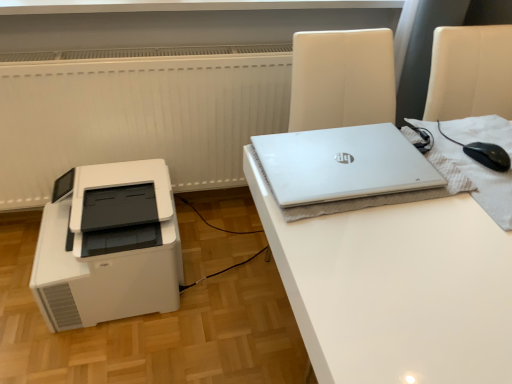
At what (x,y) coordinates should I click in order to perform the action: click on vacant space in front of black matte mouse at right. Please return your answer as a coordinate pair (x, y). Looking at the image, I should click on (482, 195).